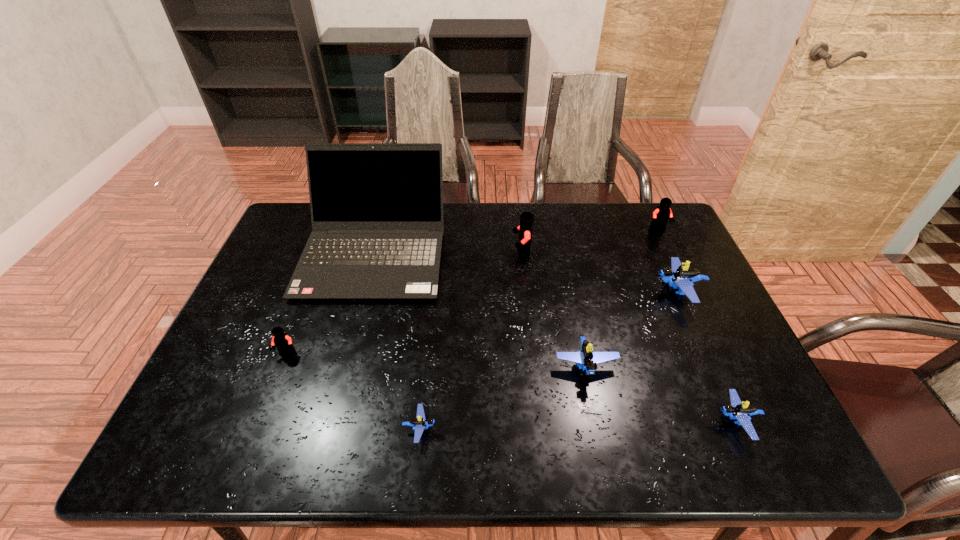
At what (x,y) coordinates should I click in order to perform the action: click on the leftmost black Lego. Please return your answer as a coordinate pair (x, y). The width and height of the screenshot is (960, 540). Looking at the image, I should click on (283, 342).

Locate an element on the screen. The width and height of the screenshot is (960, 540). the nearest black Lego is located at coordinates (283, 342).

Locate an element on the screen. the second shortest Lego is located at coordinates (736, 410).

You are a GUI agent. You are given a task and a screenshot of the screen. Output one action in this format:
    pyautogui.click(x=<x>, y=<y>)
    Task: Click on the seventh tallest object
    
    Given the screenshot: What is the action you would take?
    pyautogui.click(x=736, y=410)

You are a GUI agent. You are given a task and a screenshot of the screen. Output one action in this format:
    pyautogui.click(x=<x>, y=<y>)
    Task: Click on the sixth Lego from right to left
    
    Given the screenshot: What is the action you would take?
    pyautogui.click(x=419, y=423)

Where is `the leftmost blue Lego`? The width and height of the screenshot is (960, 540). the leftmost blue Lego is located at coordinates (419, 423).

This screenshot has width=960, height=540. I want to click on vacant space located 0.390m on the screen of the black laptop computer, so click(325, 435).

Locate an element on the screen. This screenshot has width=960, height=540. vacant position located on the front-facing side of the second black Lego from left to right is located at coordinates (411, 252).

This screenshot has height=540, width=960. In order to click on blank space located 0.110m on the front-facing side of the second black Lego from left to right in this screenshot , I will do `click(477, 252)`.

Locate an element on the screen. The width and height of the screenshot is (960, 540). free space located 0.260m on the front-facing side of the second black Lego from left to right is located at coordinates (429, 252).